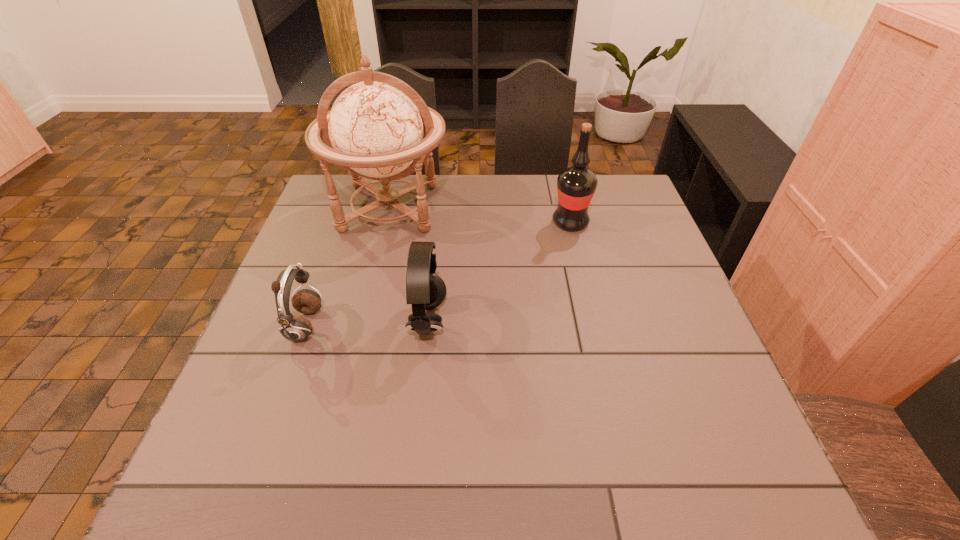
The image size is (960, 540). I want to click on vacant point located 0.130m on the ear pads of the left earphone, so click(x=376, y=326).

Locate an element on the screen. The image size is (960, 540). globe at the far edge is located at coordinates (375, 130).

I want to click on wine bottle that is positioned at the far edge, so click(x=576, y=185).

This screenshot has height=540, width=960. I want to click on globe that is positioned at the left edge, so click(x=375, y=130).

At what (x,y) coordinates should I click in order to perform the action: click on earphone that is at the left edge. Please return your answer as a coordinate pair (x, y). The height and width of the screenshot is (540, 960). Looking at the image, I should click on (295, 328).

Identify the location of object present at the far left corner. The image size is (960, 540). (375, 130).

In the image, there is a desktop. Identify the location of free space at the far edge. This screenshot has width=960, height=540. (408, 198).

I want to click on vacant position at the near edge of the desktop, so click(328, 460).

At what (x,y) coordinates should I click in order to perform the action: click on blank space at the left edge of the desktop. Please return your answer as a coordinate pair (x, y). The width and height of the screenshot is (960, 540). Looking at the image, I should click on (341, 259).

In the image, there is a desktop. Identify the location of vacant space at the right edge. (629, 259).